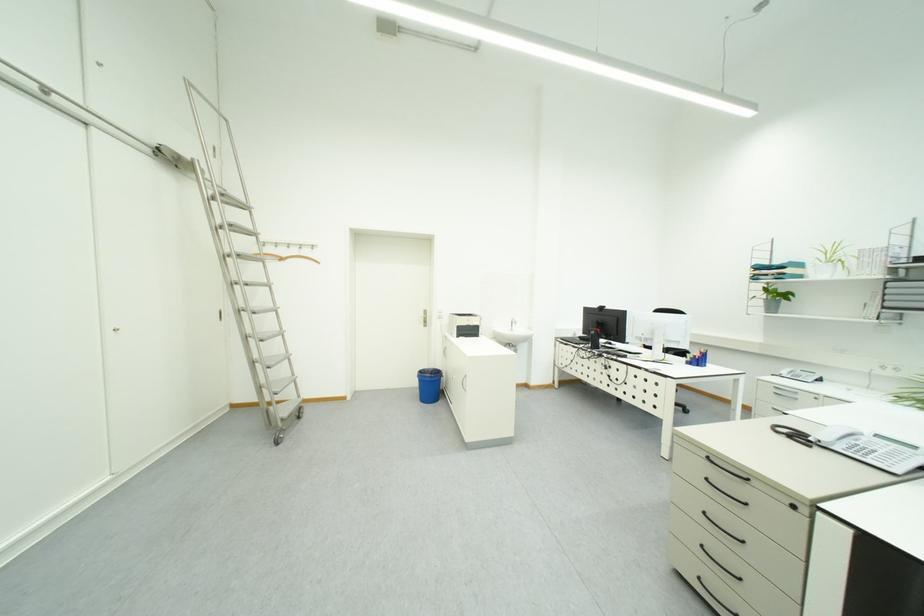
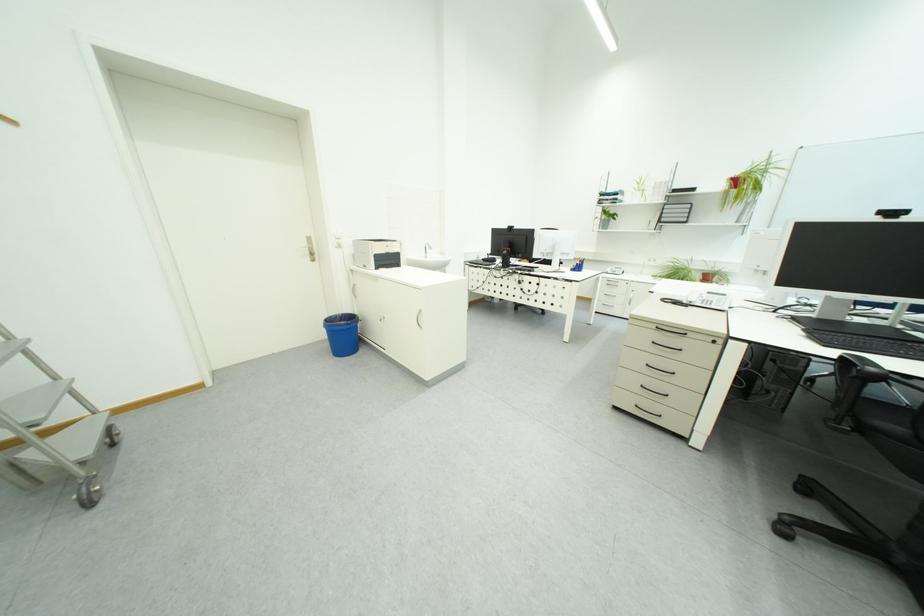
Locate, in the second image, the point that corresponds to pixel 444 387 in the first image.

(358, 336)